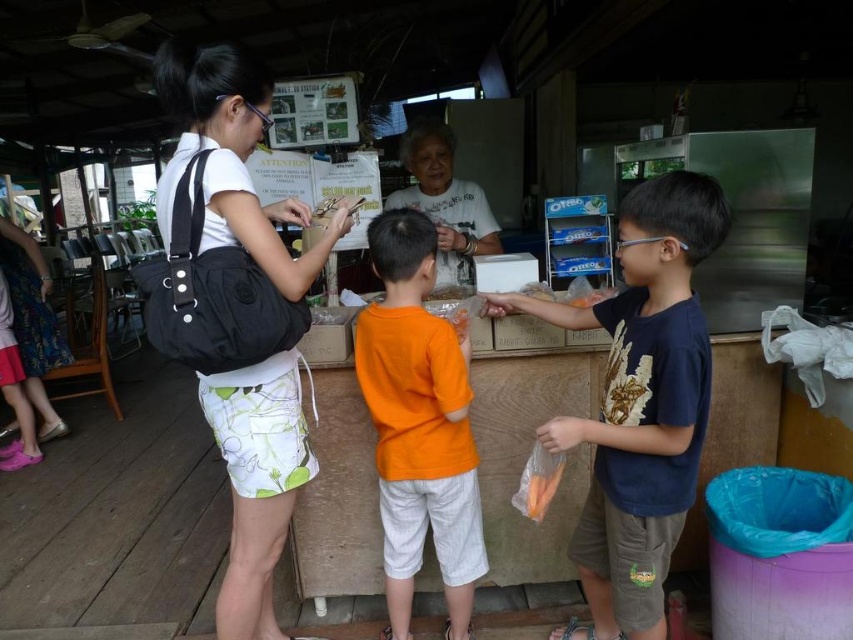
You are a vendor at the food stall and need to place both the orange cotton shirt at center and the orange matte carrot at center on a small shelf. Which item should you place first to ensure both fit?

The orange matte carrot at center is smaller in size compared to the orange cotton shirt at center, so you should place the orange cotton shirt at center first to ensure both items can fit on the shelf.